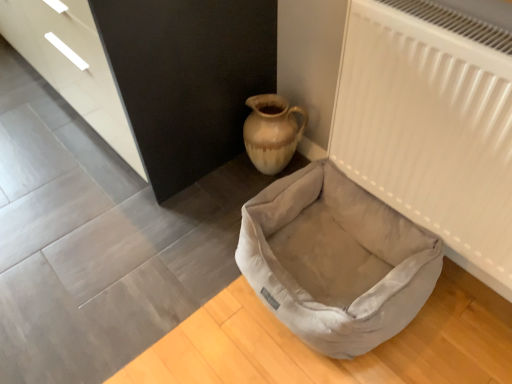
In order to face matte beige ceramic vase at upper left, should I rotate leftwards or rightwards?

Turn right approximately 2.407 degrees to face it.

Find the location of `matte beige ceramic vase at upper left`. matte beige ceramic vase at upper left is located at coordinates (272, 132).

Identify the location of white matte radiator at upper right. This screenshot has width=512, height=384. (429, 131).

Locate an element on the screen. The height and width of the screenshot is (384, 512). matte black dresser at upper left is located at coordinates (156, 75).

Looking at this image, who is bigger, matte black dresser at upper left or velvet beige dog bed at lower center?

matte black dresser at upper left.

Are matte black dresser at upper left and velvet beige dog bed at lower center making contact?

No, matte black dresser at upper left is not making contact with velvet beige dog bed at lower center.

Is velvet beige dog bed at lower center inside matte black dresser at upper left?

No, velvet beige dog bed at lower center is located outside of matte black dresser at upper left.

Measure the distance between matte black dresser at upper left and velvet beige dog bed at lower center.

A distance of 23.63 inches exists between matte black dresser at upper left and velvet beige dog bed at lower center.

Is point (447, 159) positioned before point (155, 24)?

That is True.

In the scene shown: From the image's perspective, between white matte radiator at upper right and matte black dresser at upper left, which one is located above?

From the image's view, matte black dresser at upper left is above.

Measure the distance between white matte radiator at upper right and matte black dresser at upper left.

white matte radiator at upper right and matte black dresser at upper left are 65.69 centimeters apart from each other.

Find the location of `radiator below the matte black dresser at upper left (from the image's perspective)`. radiator below the matte black dresser at upper left (from the image's perspective) is located at coordinates (429, 131).

Which object is positioned more to the right, matte beige ceramic vase at upper left or white matte radiator at upper right?

white matte radiator at upper right is more to the right.

From the image's perspective, is matte beige ceramic vase at upper left beneath white matte radiator at upper right?

Incorrect, from the image's perspective, matte beige ceramic vase at upper left is higher than white matte radiator at upper right.

Between matte beige ceramic vase at upper left and white matte radiator at upper right, which one has smaller width?

With smaller width is white matte radiator at upper right.

From a real-world perspective, which object rests below the other?

matte beige ceramic vase at upper left, from a real-world perspective.

Is matte black dresser at upper left beside white matte radiator at upper right?

There is a gap between matte black dresser at upper left and white matte radiator at upper right.

Considering the sizes of objects matte black dresser at upper left and white matte radiator at upper right in the image provided, who is taller, matte black dresser at upper left or white matte radiator at upper right?

With more height is matte black dresser at upper left.

Is matte black dresser at upper left facing towards white matte radiator at upper right?

No, matte black dresser at upper left is not aimed at white matte radiator at upper right.

Where is `dresser below the white matte radiator at upper right (from a real-world perspective)`? Image resolution: width=512 pixels, height=384 pixels. dresser below the white matte radiator at upper right (from a real-world perspective) is located at coordinates (156, 75).

From the image's perspective, is matte beige ceramic vase at upper left below velvet beige dog bed at lower center?

Actually, matte beige ceramic vase at upper left appears above velvet beige dog bed at lower center in the image.

Image resolution: width=512 pixels, height=384 pixels. I want to click on dog bed below the matte beige ceramic vase at upper left (from the image's perspective), so click(335, 260).

In the scene shown: Which object is further away from the camera taking this photo, matte beige ceramic vase at upper left or velvet beige dog bed at lower center?

matte beige ceramic vase at upper left is further away from the camera.

From the picture: Is matte beige ceramic vase at upper left touching velvet beige dog bed at lower center?

No.

Is point (420, 205) in front of point (322, 239)?

Yes, it is.

Consider the image. Is white matte radiator at upper right beside velvet beige dog bed at lower center?

No, white matte radiator at upper right is not next to velvet beige dog bed at lower center.

Is velvet beige dog bed at lower center inside white matte radiator at upper right?

No, white matte radiator at upper right does not contain velvet beige dog bed at lower center.

In order to click on vase that appears on the left of velvet beige dog bed at lower center in this screenshot , I will do `click(272, 132)`.

From the image's perspective, is velvet beige dog bed at lower center located above or below matte beige ceramic vase at upper left?

velvet beige dog bed at lower center is situated lower than matte beige ceramic vase at upper left in the image.

Is velvet beige dog bed at lower center not close to matte beige ceramic vase at upper left?

No.

Which object is further away from the camera taking this photo, velvet beige dog bed at lower center or matte beige ceramic vase at upper left?

matte beige ceramic vase at upper left is further away from the camera.

This screenshot has width=512, height=384. What are the coordinates of `dog bed below the matte black dresser at upper left (from a real-world perspective)` in the screenshot? It's located at (335, 260).

Where is `radiator above the matte black dresser at upper left (from a real-world perspective)`? This screenshot has height=384, width=512. radiator above the matte black dresser at upper left (from a real-world perspective) is located at coordinates coord(429,131).

Which object lies further to the anchor point matte beige ceramic vase at upper left, velvet beige dog bed at lower center or white matte radiator at upper right?

white matte radiator at upper right is further to matte beige ceramic vase at upper left.

Estimate the real-world distances between objects in this image. Which object is closer to velvet beige dog bed at lower center, white matte radiator at upper right or matte black dresser at upper left?

The object closer to velvet beige dog bed at lower center is white matte radiator at upper right.

Which object lies further to the anchor point matte beige ceramic vase at upper left, velvet beige dog bed at lower center or matte black dresser at upper left?

velvet beige dog bed at lower center.

When comparing their distances from white matte radiator at upper right, does velvet beige dog bed at lower center or matte beige ceramic vase at upper left seem further?

matte beige ceramic vase at upper left lies further to white matte radiator at upper right than the other object.

When comparing their distances from white matte radiator at upper right, does velvet beige dog bed at lower center or matte black dresser at upper left seem further?

Based on the image, matte black dresser at upper left appears to be further to white matte radiator at upper right.

Considering their positions, is matte black dresser at upper left positioned further to velvet beige dog bed at lower center than white matte radiator at upper right?

matte black dresser at upper left is positioned further to the anchor velvet beige dog bed at lower center.

Considering their positions, is matte beige ceramic vase at upper left positioned further to white matte radiator at upper right than velvet beige dog bed at lower center?

matte beige ceramic vase at upper left lies further to white matte radiator at upper right than the other object.

From the picture: Which object lies nearer to the anchor point white matte radiator at upper right, matte black dresser at upper left or velvet beige dog bed at lower center?

velvet beige dog bed at lower center is positioned closer to the anchor white matte radiator at upper right.

Identify the location of dog bed between matte black dresser at upper left and white matte radiator at upper right in the horizontal direction. (335, 260).

Where is `dog bed between white matte radiator at upper right and matte beige ceramic vase at upper left from front to back`? This screenshot has width=512, height=384. dog bed between white matte radiator at upper right and matte beige ceramic vase at upper left from front to back is located at coordinates pyautogui.click(x=335, y=260).

Where is `vase between matte black dresser at upper left and white matte radiator at upper right`? Image resolution: width=512 pixels, height=384 pixels. vase between matte black dresser at upper left and white matte radiator at upper right is located at coordinates (272, 132).

Identify the location of vase between matte black dresser at upper left and velvet beige dog bed at lower center. The image size is (512, 384). (272, 132).